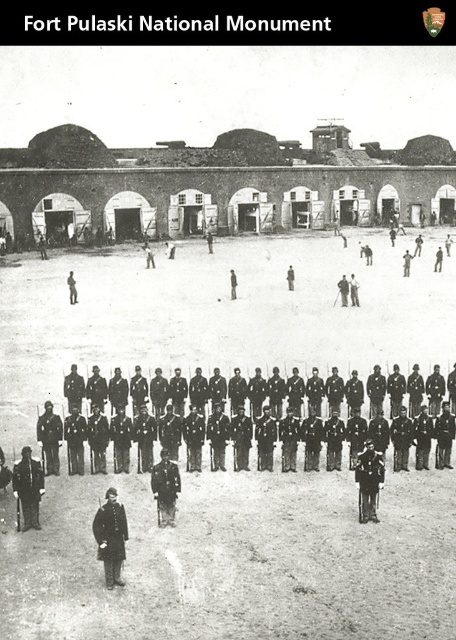
You are a historian examining this historical photograph of Fort Pulaski. You notice two items at the center of the image. Which item is narrower in width between the dark brown leather coat at center and the dark uniform at center?

The dark brown leather coat at center is thinner than the dark uniform at center, so the dark brown leather coat at center is narrower in width.